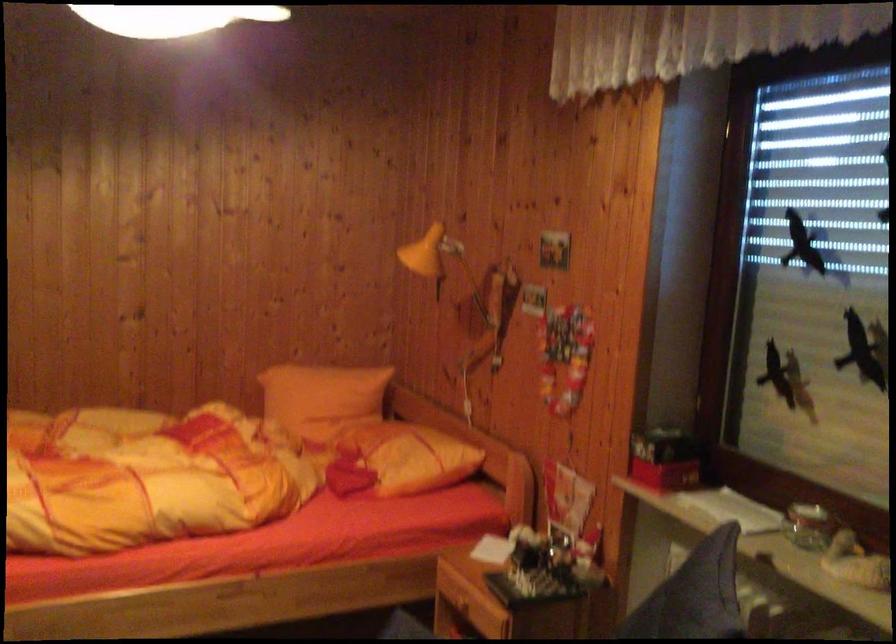
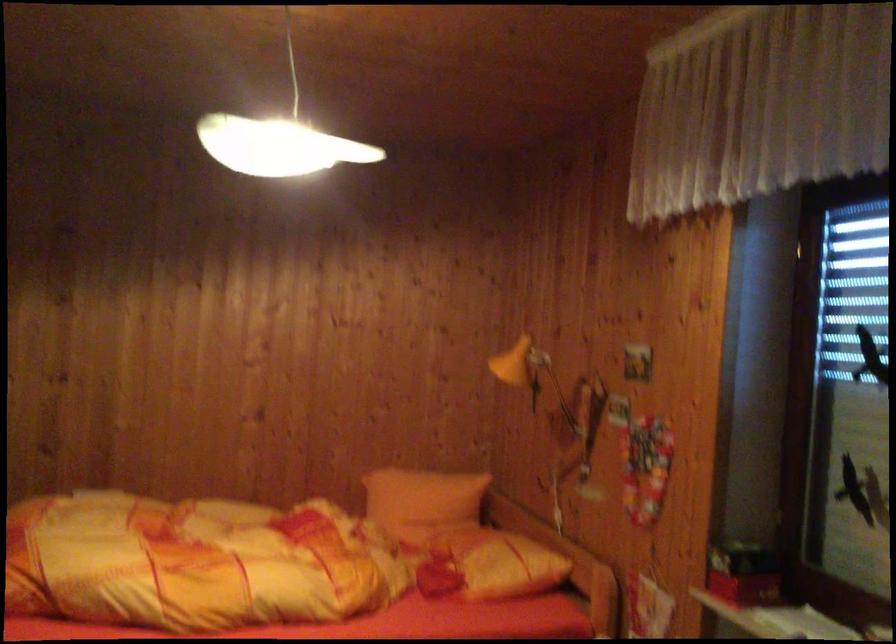
Question: How did the camera likely rotate?

Choices:
 (A) Left
 (B) Right
 (C) Up
 (D) Down

Answer: (A)